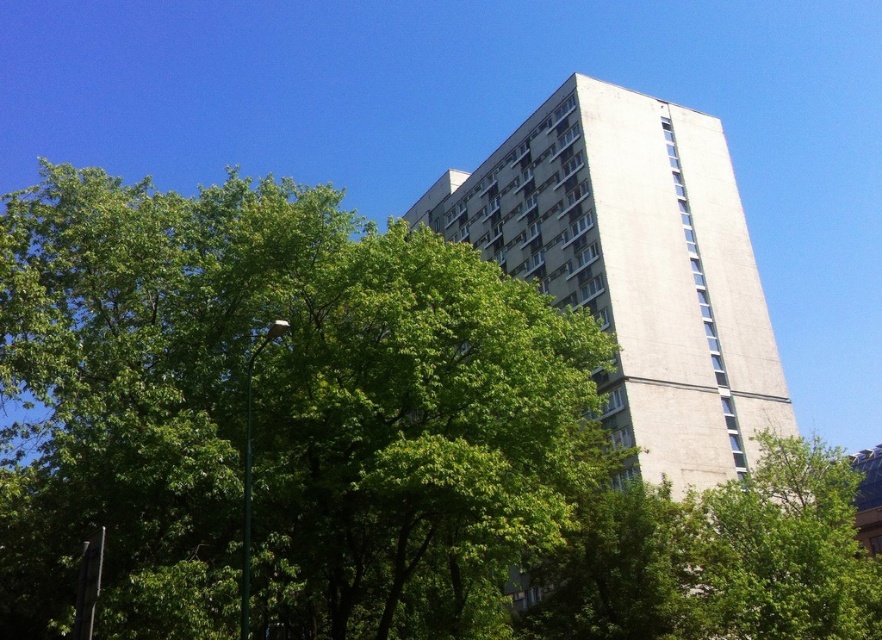
Question: Does green leafy tree at center come in front of white concrete building at center?

Choices:
 (A) yes
 (B) no

Answer: (A)

Question: Which point is closer to the camera taking this photo?

Choices:
 (A) coord(178,301)
 (B) coord(679,232)

Answer: (A)

Question: Which object is farther from the camera taking this photo?

Choices:
 (A) white concrete building at center
 (B) green leafy tree at center

Answer: (A)

Question: Is green leafy tree at center bigger than white concrete building at center?

Choices:
 (A) no
 (B) yes

Answer: (A)

Question: Considering the relative positions of green leafy tree at center and white concrete building at center in the image provided, where is green leafy tree at center located with respect to white concrete building at center?

Choices:
 (A) right
 (B) left

Answer: (B)